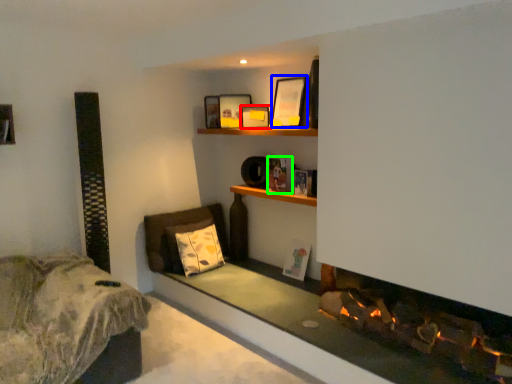
Question: Which is nearer to the picture frame (highlighted by a red box)? picture frame (highlighted by a blue box) or book (highlighted by a green box).

Choices:
 (A) picture frame
 (B) book

Answer: (A)